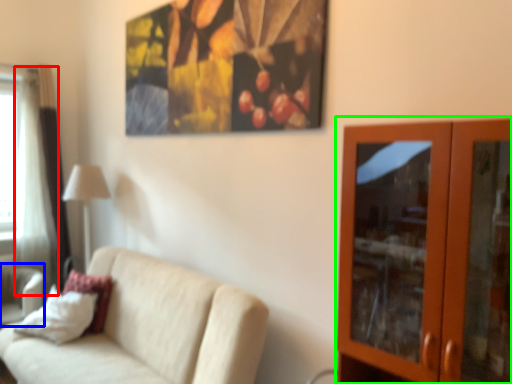
Question: Considering the real-world distances, which object is farthest from curtain (highlighted by a red box)? swivel chair (highlighted by a blue box) or dresser (highlighted by a green box)?

Choices:
 (A) swivel chair
 (B) dresser

Answer: (B)